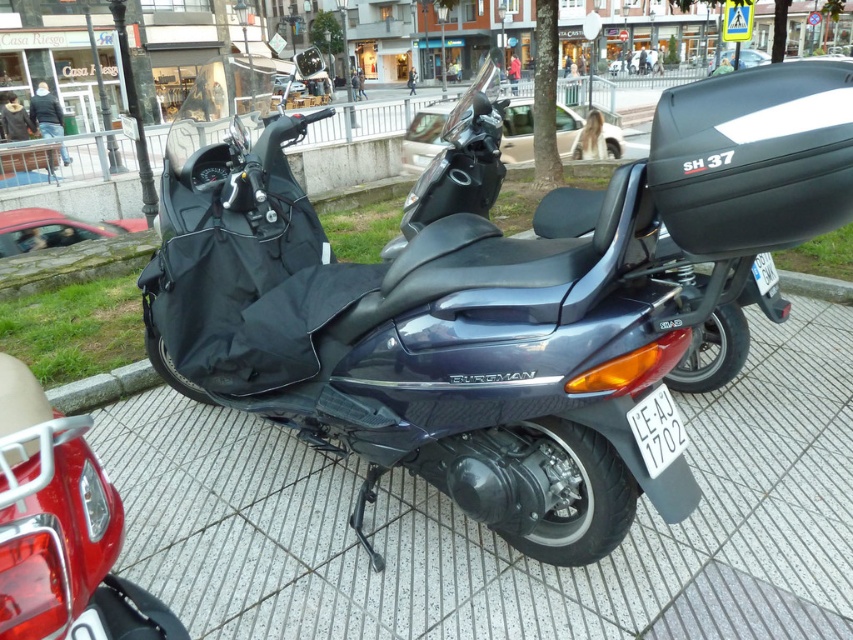
Question: Which point is farther to the camera?

Choices:
 (A) black plastic license plate at lower center
 (B) white plastic license plate at lower center

Answer: (B)

Question: Which of the following is the closest to the observer?

Choices:
 (A) black plastic license plate at lower center
 (B) matte black bag at lower left
 (C) satin black scooter at center
 (D) gray textured pavement at center

Answer: (B)

Question: Does gray textured pavement at center have a lesser width compared to white plastic license plate at lower center?

Choices:
 (A) no
 (B) yes

Answer: (A)

Question: Considering the relative positions of satin black scooter at center and black plastic license plate at lower center in the image provided, where is satin black scooter at center located with respect to black plastic license plate at lower center?

Choices:
 (A) left
 (B) right

Answer: (A)

Question: Does black plastic license plate at lower center appear under white plastic license plate at lower center?

Choices:
 (A) no
 (B) yes

Answer: (B)

Question: Estimate the real-world distances between objects in this image. Which object is farther from the gray textured pavement at center?

Choices:
 (A) white plastic license plate at lower center
 (B) matte black bag at lower left
 (C) black plastic license plate at lower center

Answer: (A)